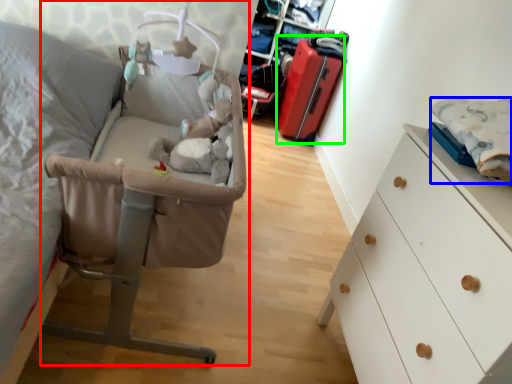
Question: Which object is the farthest from infant bed (highlighted by a red box)? Choose among these: linen (highlighted by a blue box) or luggage (highlighted by a green box).

Choices:
 (A) linen
 (B) luggage

Answer: (B)